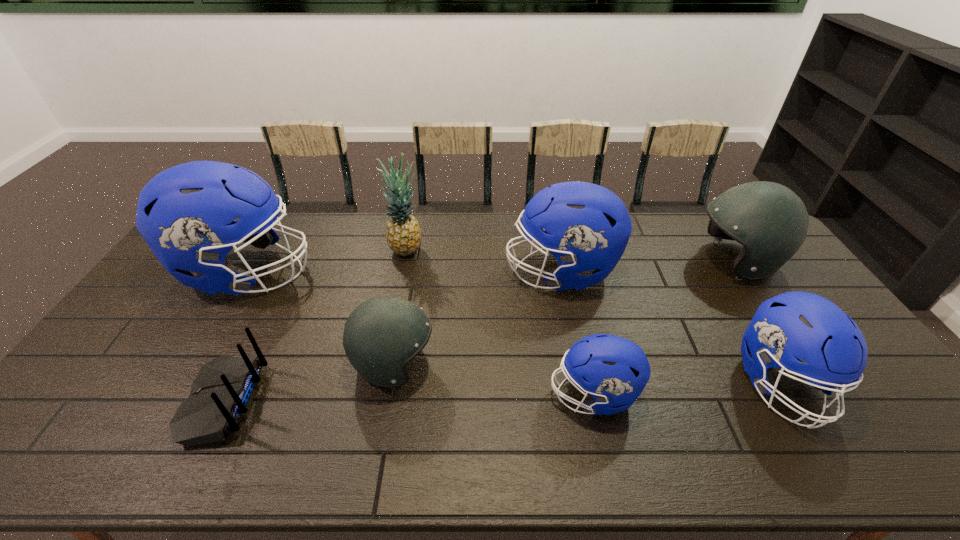
This screenshot has height=540, width=960. I want to click on the leftmost blue football helmet, so click(185, 214).

You are a GUI agent. You are given a task and a screenshot of the screen. Output one action in this format:
    pyautogui.click(x=<x>, y=<y>)
    Task: Click on the tallest football helmet
    The width and height of the screenshot is (960, 540).
    Given the screenshot: What is the action you would take?
    pyautogui.click(x=185, y=214)

Where is `yellow pineapple`? yellow pineapple is located at coordinates (403, 234).

You are a GUI agent. You are given a task and a screenshot of the screen. Output one action in this format:
    pyautogui.click(x=<x>, y=<y>)
    Task: Click on the second biggest blue football helmet
    The image size is (960, 540).
    Given the screenshot: What is the action you would take?
    pyautogui.click(x=587, y=227)

Where is `the farther green football helmet`? The height and width of the screenshot is (540, 960). the farther green football helmet is located at coordinates (771, 222).

The image size is (960, 540). I want to click on the right green football helmet, so click(771, 222).

Identify the location of the third biggest blue football helmet. (795, 325).

Where is `the left green football helmet`? the left green football helmet is located at coordinates (383, 334).

Locate an element on the screen. The height and width of the screenshot is (540, 960). the smaller green football helmet is located at coordinates (383, 334).

Find the location of `the smallest blue football helmet`. the smallest blue football helmet is located at coordinates click(613, 370).